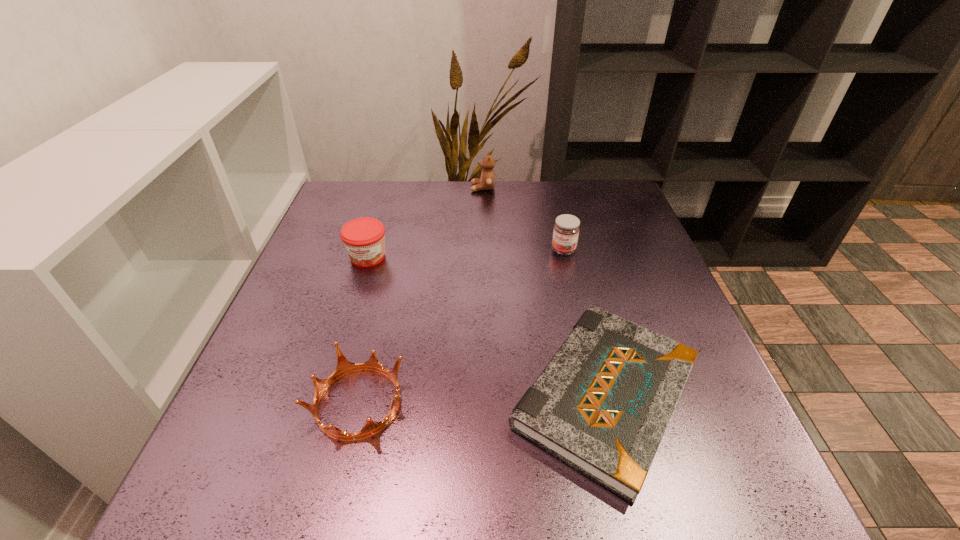
The image size is (960, 540). What are the coordinates of `unoccupied area between the tallest object and the crown` in the screenshot? It's located at (420, 295).

The width and height of the screenshot is (960, 540). Identify the location of empty location between the fourth tallest object and the notebook. (482, 399).

Where is `free spot between the left jam and the shortest object`? The image size is (960, 540). free spot between the left jam and the shortest object is located at coordinates coord(487,326).

I want to click on free space between the crown and the right jam, so [461, 326].

Identify the location of the fourth closest object to the left jam. The image size is (960, 540). (566, 230).

The width and height of the screenshot is (960, 540). Find the location of `object that is the second closest one to the left jam`. object that is the second closest one to the left jam is located at coordinates (487, 181).

I want to click on free location that satisfies the following two spatial constraints: 1. on the label side of the notebook; 2. on the right side of the left jam, so click(x=325, y=395).

At what (x,y) coordinates should I click in order to perform the action: click on free region that satisfies the following two spatial constraints: 1. on the front-facing side of the farthest object; 2. on the right side of the right jam. Please return your answer as a coordinate pair (x, y). Image resolution: width=960 pixels, height=540 pixels. Looking at the image, I should click on (484, 250).

The height and width of the screenshot is (540, 960). I want to click on vacant space that satisfies the following two spatial constraints: 1. on the front-facing side of the teddy bear; 2. on the label side of the left jam, so click(484, 257).

Image resolution: width=960 pixels, height=540 pixels. Find the location of `free space in the image that satisfies the following two spatial constraints: 1. on the front-facing side of the teddy bear; 2. on the left side of the right jam`. free space in the image that satisfies the following two spatial constraints: 1. on the front-facing side of the teddy bear; 2. on the left side of the right jam is located at coordinates (484, 250).